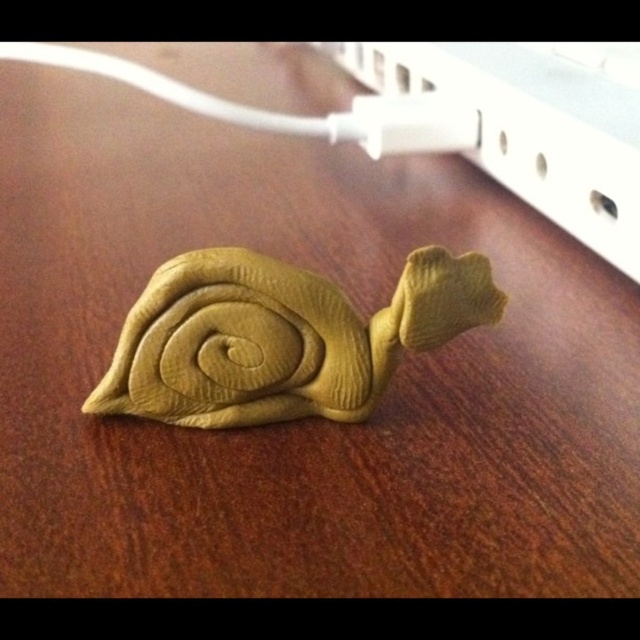
You are organizing a small desk and need to place the matte yellow clay snail at center and the white plastic plug at upper center. Given that the desk is 24 inches wide, can both items fit side by side without overlapping?

The matte yellow clay snail at center is 22.97 inches away from the white plastic plug at upper center. Since the desk is 24 inches wide, there is enough space between them to fit both items side by side without overlapping.

You are organizing a desk and need to place both the matte yellow clay snail at center and the white plastic plug at upper center. Given their sizes, which object should you place first to ensure both fit on the desk?

The matte yellow clay snail at center occupies less space than the white plastic plug at upper center, so you should place the white plastic plug at upper center first to ensure both fit on the desk.